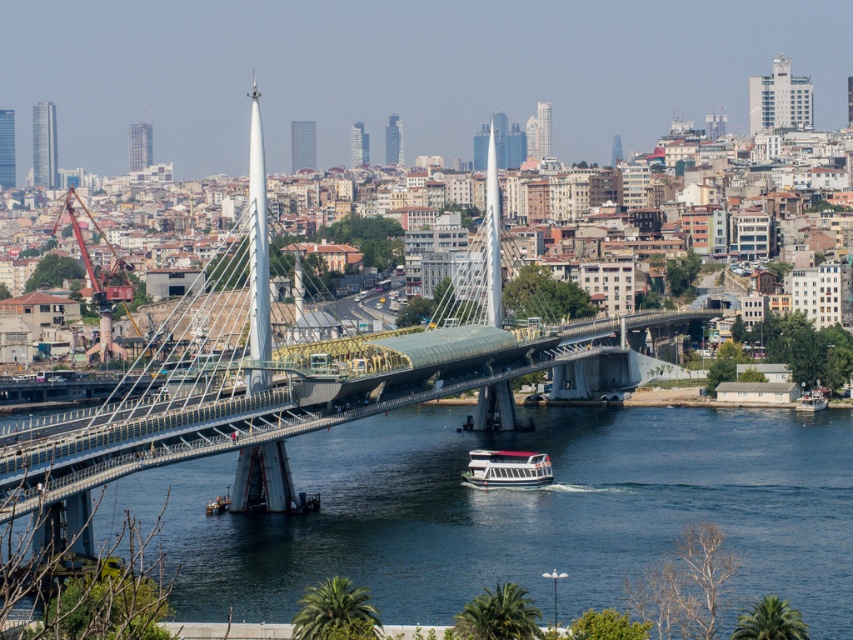
Question: Does blue water at center appear on the right side of metallic glass bridge at center?

Choices:
 (A) yes
 (B) no

Answer: (A)

Question: Which object is the farthest from the blue water at center?

Choices:
 (A) white glossy boat at lower center
 (B) metallic glass bridge at center

Answer: (B)

Question: Can you confirm if blue water at center is smaller than metallic glass bridge at center?

Choices:
 (A) yes
 (B) no

Answer: (A)

Question: Can you confirm if blue water at center is positioned to the left of white glossy boat at lower center?

Choices:
 (A) no
 (B) yes

Answer: (A)

Question: Which point is closer to the camera?

Choices:
 (A) (151, 385)
 (B) (651, 433)

Answer: (B)

Question: Among these points, which one is farthest from the camera?

Choices:
 (A) (642, 429)
 (B) (154, 461)
 (C) (479, 456)

Answer: (A)